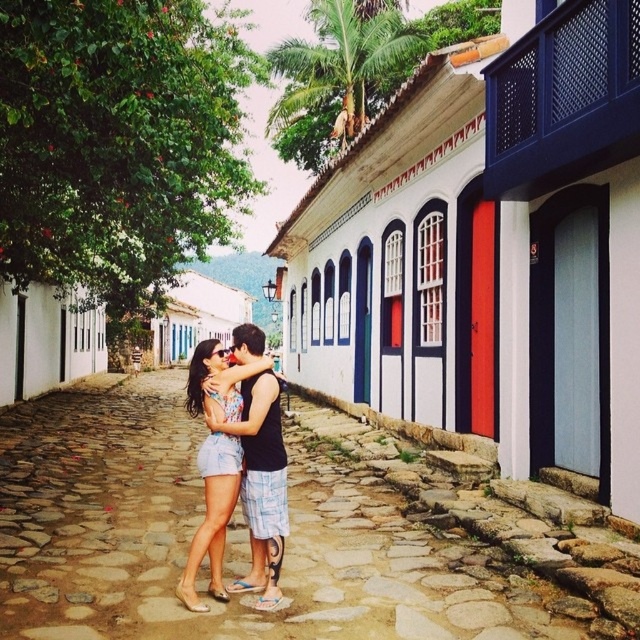
Question: Which object appears closest to the camera in this image?

Choices:
 (A) denim shorts at center
 (B) smooth stone alley at center

Answer: (B)

Question: Is smooth stone alley at center closer to the viewer compared to denim shorts at center?

Choices:
 (A) no
 (B) yes

Answer: (B)

Question: Is smooth stone alley at center above denim shorts at center?

Choices:
 (A) no
 (B) yes

Answer: (A)

Question: Does smooth stone alley at center have a smaller size compared to denim shorts at center?

Choices:
 (A) yes
 (B) no

Answer: (B)

Question: Which object is farther from the camera taking this photo?

Choices:
 (A) smooth stone alley at center
 (B) denim shorts at center

Answer: (B)